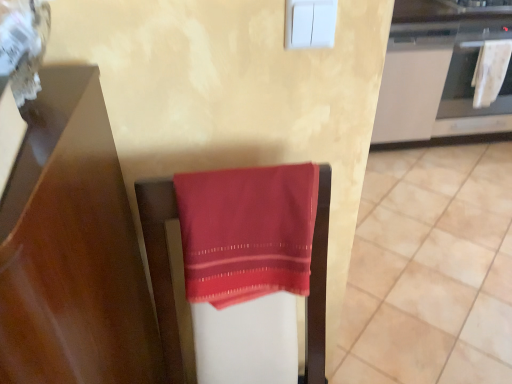
Question: Is white fabric oven at upper right aimed at satin red cloth at center?

Choices:
 (A) no
 (B) yes

Answer: (A)

Question: Does white fabric oven at upper right have a greater width compared to satin red cloth at center?

Choices:
 (A) yes
 (B) no

Answer: (A)

Question: Is white fabric oven at upper right completely or partially outside of satin red cloth at center?

Choices:
 (A) no
 (B) yes

Answer: (B)

Question: Can you confirm if white fabric oven at upper right is positioned to the left of satin red cloth at center?

Choices:
 (A) yes
 (B) no

Answer: (B)

Question: Is white fabric oven at upper right facing away from satin red cloth at center?

Choices:
 (A) yes
 (B) no

Answer: (B)

Question: From a real-world perspective, is white fabric oven at upper right under satin red cloth at center?

Choices:
 (A) no
 (B) yes

Answer: (B)

Question: Can you confirm if smooth red towel at center is wider than satin red cloth at center?

Choices:
 (A) no
 (B) yes

Answer: (B)

Question: From the image's perspective, is smooth red towel at center over satin red cloth at center?

Choices:
 (A) no
 (B) yes

Answer: (A)

Question: Does smooth red towel at center have a lesser width compared to satin red cloth at center?

Choices:
 (A) no
 (B) yes

Answer: (A)

Question: Is smooth red towel at center facing towards satin red cloth at center?

Choices:
 (A) no
 (B) yes

Answer: (A)

Question: Considering the relative sizes of smooth red towel at center and satin red cloth at center in the image provided, is smooth red towel at center bigger than satin red cloth at center?

Choices:
 (A) yes
 (B) no

Answer: (A)

Question: From the image's perspective, does smooth red towel at center appear lower than satin red cloth at center?

Choices:
 (A) yes
 (B) no

Answer: (A)

Question: Is white textured towel at right at the right side of white fabric oven at upper right?

Choices:
 (A) yes
 (B) no

Answer: (B)